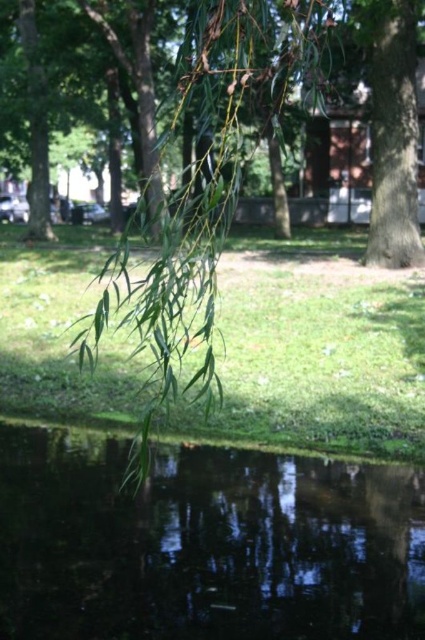
Looking at this image, you are a gardener planning to mow the green leafy grass at center and trim the green leafy branch at lower left. Which object requires more attention to its width for the tasks?

The green leafy grass at center requires more attention to its width because its width is less than the green leafy branch at lower left, so you need to ensure the mower can handle the narrower area.

You are a small insect trying to reach the transparent liquid water at lower center from the green leafy grass at center. Which direction should you move to get there?

The transparent liquid water at lower center is positioned under green leafy grass at center, so the insect should move downward from the green leafy grass at center to reach the transparent liquid water at lower center.